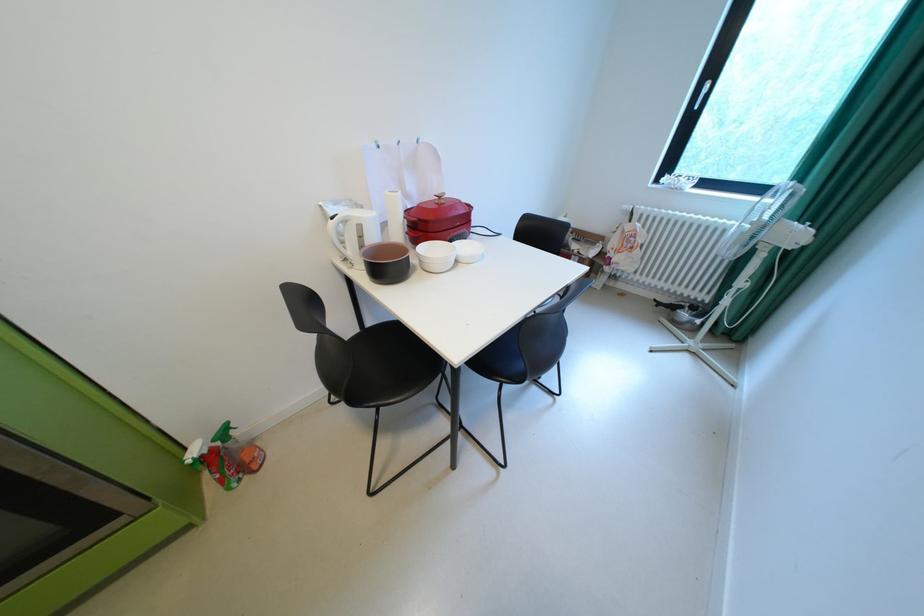
Find where to squeez the red spray bottle trigger. Please return your answer as a coordinate pair (x, y).

(438, 220)